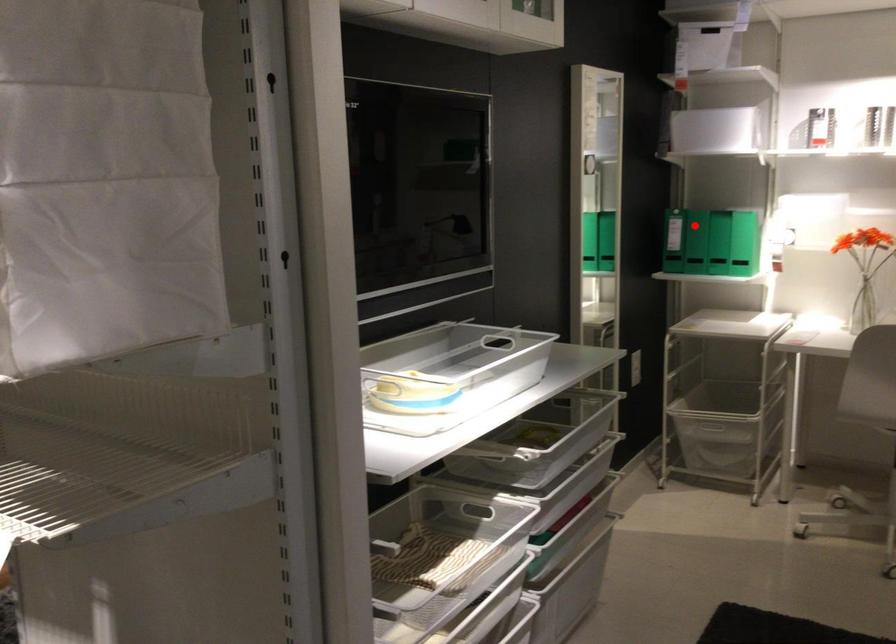
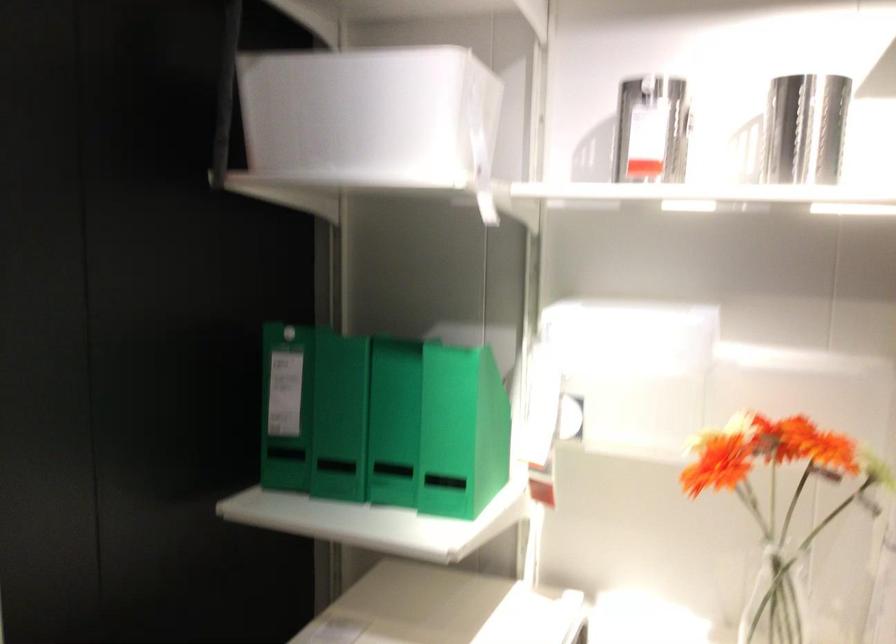
The point at the highlighted location is marked in the first image. Where is the corresponding point in the second image?

(286, 406)